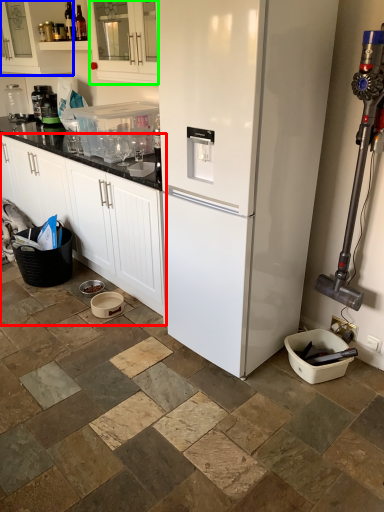
Question: Which object is the farthest from cabinetry (highlighted by a red box)? Choose among these: cabinetry (highlighted by a blue box) or cabinetry (highlighted by a green box).

Choices:
 (A) cabinetry
 (B) cabinetry

Answer: (A)